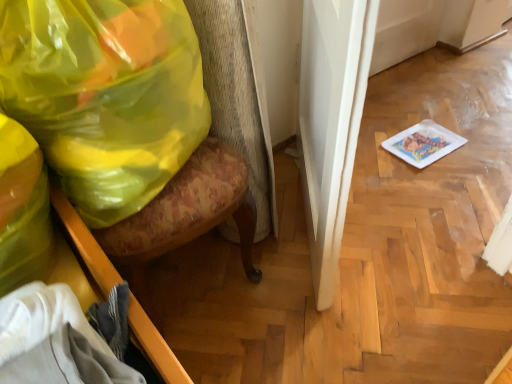
Question: From a real-world perspective, is wooden drawer at lower left positioned above or below floral fabric swivel chair at left?

Choices:
 (A) below
 (B) above

Answer: (B)

Question: Looking at the image, does wooden drawer at lower left seem bigger or smaller compared to floral fabric swivel chair at left?

Choices:
 (A) small
 (B) big

Answer: (A)

Question: Estimate the real-world distances between objects in this image. Which object is closer to the wooden drawer at lower left?

Choices:
 (A) floral fabric swivel chair at left
 (B) translucent yellow plastic bag at left

Answer: (B)

Question: Based on their relative distances, which object is nearer to the translucent yellow plastic bag at left?

Choices:
 (A) wooden drawer at lower left
 (B) floral fabric swivel chair at left

Answer: (A)